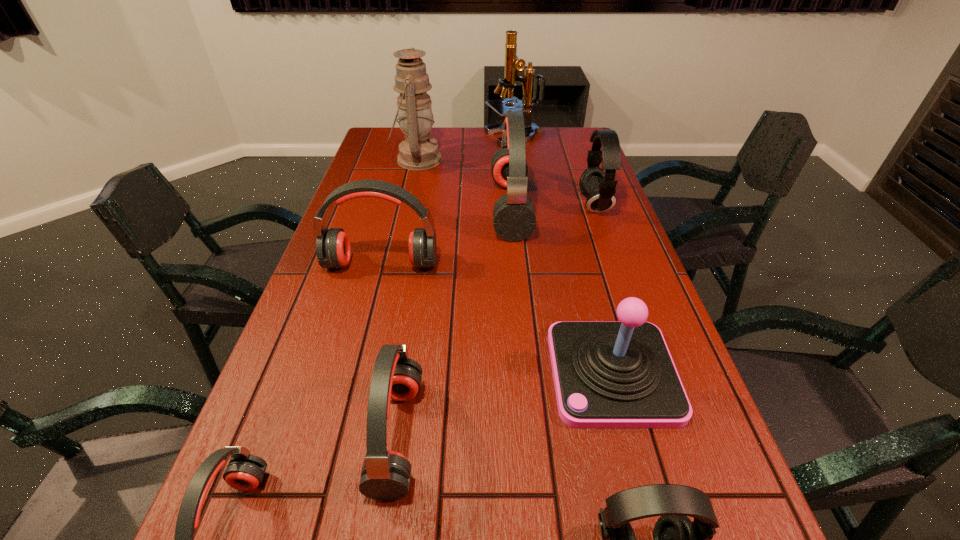
The height and width of the screenshot is (540, 960). Identify the location of object located in the far left corner section of the desktop. (419, 152).

The height and width of the screenshot is (540, 960). What are the coordinates of `vacant space at the far edge` in the screenshot? It's located at (489, 146).

I want to click on vacant space at the left edge of the desktop, so (272, 409).

Where is `vacant point located between the pink joystick and the biggest red earphone`? The image size is (960, 540). vacant point located between the pink joystick and the biggest red earphone is located at coordinates (562, 291).

What are the coordinates of `free area in between the oil lamp and the gold microscope` in the screenshot? It's located at (466, 148).

Locate an element on the screen. vacant point located between the seventh shortest object and the second smallest red earphone is located at coordinates (454, 322).

The width and height of the screenshot is (960, 540). Find the location of `vacant area that lies between the joystick and the third biggest red earphone`. vacant area that lies between the joystick and the third biggest red earphone is located at coordinates (505, 404).

Where is `vacant space that is in between the microscope and the third farthest earphone`? Image resolution: width=960 pixels, height=540 pixels. vacant space that is in between the microscope and the third farthest earphone is located at coordinates (448, 200).

Point out which object is positioned as the nearest to the gold microscope. Please provide its 2D coordinates. Your answer should be formatted as a tuple, i.e. [(x, y)], where the tuple contains the x and y coordinates of a point satisfying the conditions above.

[(419, 152)]

This screenshot has width=960, height=540. Identify the location of the closest object to the bigger black earphone. (514, 219).